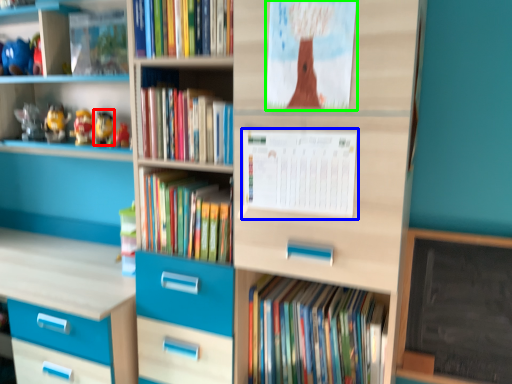
Question: Which object is positioned closest to toy (highlighted by a red box)? Select from paperback book (highlighted by a blue box) and paperback book (highlighted by a green box).

Choices:
 (A) paperback book
 (B) paperback book

Answer: (A)